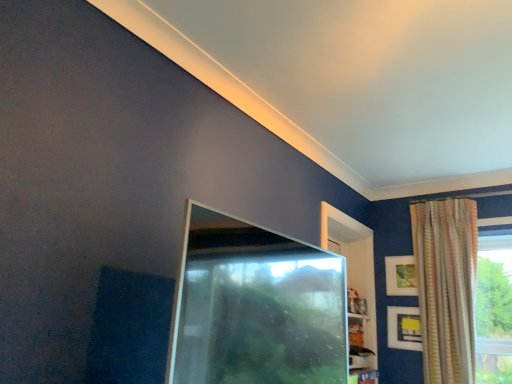
Image resolution: width=512 pixels, height=384 pixels. In order to click on transparent glass screen door at center in this screenshot , I will do `click(255, 306)`.

You are a GUI agent. You are given a task and a screenshot of the screen. Output one action in this format:
    pyautogui.click(x=<x>, y=<y>)
    Task: Click on the matte gold picture frame at upper right, the 1th picture frame positioned from the top
    
    Given the screenshot: What is the action you would take?
    pyautogui.click(x=401, y=276)

You are a GUI agent. You are given a task and a screenshot of the screen. Output one action in this format:
    pyautogui.click(x=<x>, y=<y>)
    Task: Click on the transparent glass screen door at center
    This screenshot has height=384, width=512.
    Given the screenshot: What is the action you would take?
    pyautogui.click(x=255, y=306)

From the image's perspective, between transparent glass screen door at center and striped fabric curtain at upper right, who is located below?

striped fabric curtain at upper right, from the image's perspective.

You are a GUI agent. You are given a task and a screenshot of the screen. Output one action in this format:
    pyautogui.click(x=<x>, y=<y>)
    Task: Click on the curtain on the right of transparent glass screen door at center
    
    Given the screenshot: What is the action you would take?
    pyautogui.click(x=446, y=286)

Can you tell me how much transparent glass screen door at center and striped fabric curtain at upper right differ in facing direction?

The angular difference between transparent glass screen door at center and striped fabric curtain at upper right is 88.2 degrees.

In order to click on screen door below the matte black picture frame at upper right, which is counted as the 1th picture frame, starting from the bottom (from a real-world perspective) in this screenshot , I will do `click(255, 306)`.

Could you tell me if matte black picture frame at upper right, which is counted as the 1th picture frame, starting from the bottom, is facing transparent glass screen door at center?

Yes, matte black picture frame at upper right, which is counted as the 1th picture frame, starting from the bottom, is aimed at transparent glass screen door at center.

From the image's perspective, is matte black picture frame at upper right, acting as the 2th picture frame starting from the top, under transparent glass screen door at center?

Yes, from the image's perspective, matte black picture frame at upper right, acting as the 2th picture frame starting from the top, is beneath transparent glass screen door at center.

From a real-world perspective, is matte black picture frame at upper right, acting as the 2th picture frame starting from the top, located beneath transparent glass screen door at center?

No.

Is transparent glass screen door at center thinner than matte gold picture frame at upper right, the 1th picture frame positioned from the top?

No, transparent glass screen door at center is not thinner than matte gold picture frame at upper right, the 1th picture frame positioned from the top.

Considering the positions of point (207, 257) and point (412, 279), is point (207, 257) closer or farther from the camera than point (412, 279)?

Point (207, 257) appears to be closer to the viewer than point (412, 279).

Can you confirm if transparent glass screen door at center is taller than matte gold picture frame at upper right, which is counted as the 2th picture frame, starting from the bottom?

Correct, transparent glass screen door at center is much taller as matte gold picture frame at upper right, which is counted as the 2th picture frame, starting from the bottom.

Who is more distant, matte black picture frame at upper right, acting as the 2th picture frame starting from the top, or matte gold picture frame at upper right, which is counted as the 2th picture frame, starting from the bottom?

matte gold picture frame at upper right, which is counted as the 2th picture frame, starting from the bottom, is further from the camera.

Considering the points (420, 338) and (405, 267), which point is behind, point (420, 338) or point (405, 267)?

The point (405, 267) is farther from the camera.

From the image's perspective, is matte black picture frame at upper right, which is counted as the 1th picture frame, starting from the bottom, positioned above or below matte gold picture frame at upper right, which is counted as the 2th picture frame, starting from the bottom?

Clearly, from the image's perspective, matte black picture frame at upper right, which is counted as the 1th picture frame, starting from the bottom, is below matte gold picture frame at upper right, which is counted as the 2th picture frame, starting from the bottom.

Who is smaller, matte black picture frame at upper right, acting as the 2th picture frame starting from the top, or matte gold picture frame at upper right, which is counted as the 2th picture frame, starting from the bottom?

matte black picture frame at upper right, acting as the 2th picture frame starting from the top, is smaller.

The width and height of the screenshot is (512, 384). Find the location of `curtain lying in front of the matte black picture frame at upper right, acting as the 2th picture frame starting from the top`. curtain lying in front of the matte black picture frame at upper right, acting as the 2th picture frame starting from the top is located at coordinates (446, 286).

Is matte black picture frame at upper right, acting as the 2th picture frame starting from the top, bigger or smaller than striped fabric curtain at upper right?

Clearly, matte black picture frame at upper right, acting as the 2th picture frame starting from the top, is smaller in size than striped fabric curtain at upper right.

Which object is closer to the camera taking this photo, matte black picture frame at upper right, acting as the 2th picture frame starting from the top, or striped fabric curtain at upper right?

striped fabric curtain at upper right is more forward.

Considering the relative positions of matte black picture frame at upper right, acting as the 2th picture frame starting from the top, and striped fabric curtain at upper right in the image provided, is matte black picture frame at upper right, acting as the 2th picture frame starting from the top, to the left of striped fabric curtain at upper right from the viewer's perspective?

Yes.

From the image's perspective, is transparent glass screen door at center on matte black picture frame at upper right, which is counted as the 1th picture frame, starting from the bottom?

Indeed, from the image's perspective, transparent glass screen door at center is shown above matte black picture frame at upper right, which is counted as the 1th picture frame, starting from the bottom.

Is transparent glass screen door at center next to matte black picture frame at upper right, which is counted as the 1th picture frame, starting from the bottom, and touching it?

No.

Based on their sizes in the image, would you say transparent glass screen door at center is bigger or smaller than matte black picture frame at upper right, acting as the 2th picture frame starting from the top?

Considering their sizes, transparent glass screen door at center takes up more space than matte black picture frame at upper right, acting as the 2th picture frame starting from the top.

Considering their positions, is transparent glass screen door at center located in front of or behind matte black picture frame at upper right, which is counted as the 1th picture frame, starting from the bottom?

In the image, transparent glass screen door at center appears in front of matte black picture frame at upper right, which is counted as the 1th picture frame, starting from the bottom.

Considering the points (415, 279) and (450, 199), which point is behind, point (415, 279) or point (450, 199)?

Positioned behind is point (415, 279).

In the image, is matte gold picture frame at upper right, which is counted as the 2th picture frame, starting from the bottom, on the left side or the right side of striped fabric curtain at upper right?

In the image, matte gold picture frame at upper right, which is counted as the 2th picture frame, starting from the bottom, appears on the left side of striped fabric curtain at upper right.

Locate an element on the screen. Image resolution: width=512 pixels, height=384 pixels. curtain in front of the matte gold picture frame at upper right, the 1th picture frame positioned from the top is located at coordinates (446, 286).

Is matte gold picture frame at upper right, the 1th picture frame positioned from the top, inside the boundaries of striped fabric curtain at upper right, or outside?

matte gold picture frame at upper right, the 1th picture frame positioned from the top, is outside striped fabric curtain at upper right.

I want to click on curtain on the right of the transparent glass screen door at center, so click(446, 286).

From a real-world perspective, which picture frame is the 1st one above the transparent glass screen door at center? Please provide its 2D coordinates.

[(404, 328)]

Considering their positions, is matte black picture frame at upper right, which is counted as the 1th picture frame, starting from the bottom, positioned further to matte gold picture frame at upper right, which is counted as the 2th picture frame, starting from the bottom, than striped fabric curtain at upper right?

The object further to matte gold picture frame at upper right, which is counted as the 2th picture frame, starting from the bottom, is striped fabric curtain at upper right.

Consider the image. Estimate the real-world distances between objects in this image. Which object is closer to matte black picture frame at upper right, which is counted as the 1th picture frame, starting from the bottom, matte gold picture frame at upper right, which is counted as the 2th picture frame, starting from the bottom, or striped fabric curtain at upper right?

matte gold picture frame at upper right, which is counted as the 2th picture frame, starting from the bottom, lies closer to matte black picture frame at upper right, which is counted as the 1th picture frame, starting from the bottom, than the other object.

Looking at the image, which one is located further to matte gold picture frame at upper right, the 1th picture frame positioned from the top, striped fabric curtain at upper right or matte black picture frame at upper right, acting as the 2th picture frame starting from the top?

striped fabric curtain at upper right is positioned further to the anchor matte gold picture frame at upper right, the 1th picture frame positioned from the top.

Considering their positions, is transparent glass screen door at center positioned further to striped fabric curtain at upper right than matte gold picture frame at upper right, which is counted as the 2th picture frame, starting from the bottom?

transparent glass screen door at center.

From the image, which object appears to be farther from transparent glass screen door at center, striped fabric curtain at upper right or matte gold picture frame at upper right, which is counted as the 2th picture frame, starting from the bottom?

Among the two, matte gold picture frame at upper right, which is counted as the 2th picture frame, starting from the bottom, is located further to transparent glass screen door at center.

From the image, which object appears to be nearer to matte black picture frame at upper right, acting as the 2th picture frame starting from the top, matte gold picture frame at upper right, which is counted as the 2th picture frame, starting from the bottom, or transparent glass screen door at center?

Based on the image, matte gold picture frame at upper right, which is counted as the 2th picture frame, starting from the bottom, appears to be nearer to matte black picture frame at upper right, acting as the 2th picture frame starting from the top.

Consider the image. Looking at the image, which one is located further to transparent glass screen door at center, striped fabric curtain at upper right or matte black picture frame at upper right, which is counted as the 1th picture frame, starting from the bottom?

matte black picture frame at upper right, which is counted as the 1th picture frame, starting from the bottom, is positioned further to the anchor transparent glass screen door at center.

Looking at the image, which one is located closer to matte black picture frame at upper right, acting as the 2th picture frame starting from the top, striped fabric curtain at upper right or matte gold picture frame at upper right, which is counted as the 2th picture frame, starting from the bottom?

matte gold picture frame at upper right, which is counted as the 2th picture frame, starting from the bottom.

This screenshot has width=512, height=384. I want to click on picture frame between striped fabric curtain at upper right and matte gold picture frame at upper right, which is counted as the 2th picture frame, starting from the bottom, along the z-axis, so click(x=404, y=328).

Locate an element on the screen. The width and height of the screenshot is (512, 384). curtain between transparent glass screen door at center and matte black picture frame at upper right, which is counted as the 1th picture frame, starting from the bottom, in the front-back direction is located at coordinates (446, 286).

You are a GUI agent. You are given a task and a screenshot of the screen. Output one action in this format:
    pyautogui.click(x=<x>, y=<y>)
    Task: Click on the curtain positioned between transparent glass screen door at center and matte gold picture frame at upper right, the 1th picture frame positioned from the top, from near to far
    The image size is (512, 384).
    Given the screenshot: What is the action you would take?
    pyautogui.click(x=446, y=286)

Where is `picture frame between transparent glass screen door at center and matte gold picture frame at upper right, which is counted as the 2th picture frame, starting from the bottom, from front to back`? picture frame between transparent glass screen door at center and matte gold picture frame at upper right, which is counted as the 2th picture frame, starting from the bottom, from front to back is located at coordinates (404, 328).